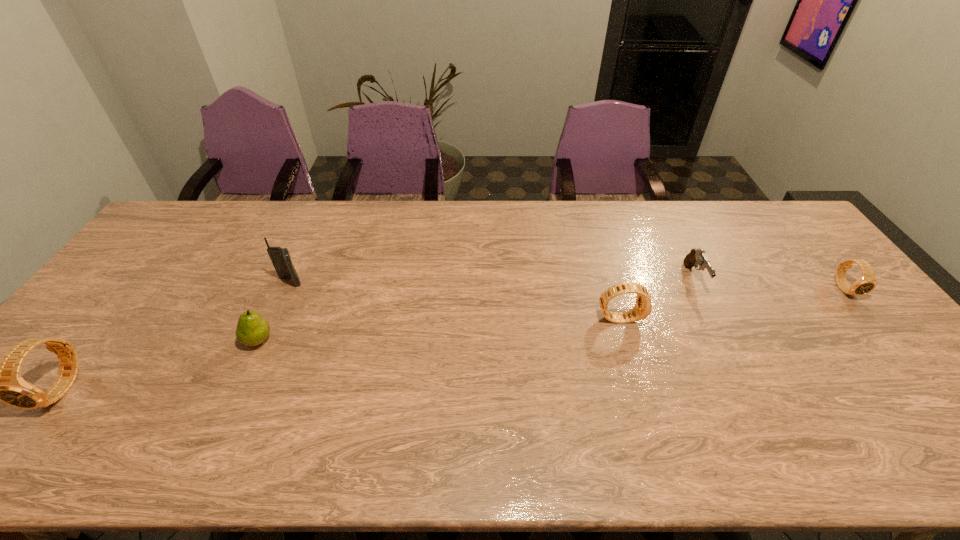
In the image, there is a desktop. Find the location of `vacant space at the left edge`. vacant space at the left edge is located at coordinates (96, 306).

This screenshot has height=540, width=960. In order to click on vacant space at the right edge of the desktop in this screenshot , I will do `click(869, 325)`.

The width and height of the screenshot is (960, 540). In order to click on free space at the far right corner in this screenshot , I will do `click(754, 206)`.

This screenshot has height=540, width=960. Identify the location of free space that is in between the cellular telephone and the second object from right to left. (492, 280).

Find the location of a particular element. free spot between the pistol and the shortest watch is located at coordinates (770, 284).

I want to click on vacant point located between the rightmost object and the second tallest watch, so click(732, 303).

The width and height of the screenshot is (960, 540). I want to click on vacant space in between the second tallest watch and the shortest watch, so click(x=732, y=303).

The image size is (960, 540). Identify the location of free spot between the second watch from right to left and the cellular telephone. (455, 300).

This screenshot has width=960, height=540. What are the coordinates of `vacant point located between the pear and the second watch from left to right` in the screenshot? It's located at (439, 329).

Find the location of a particular element. This screenshot has width=960, height=540. unoccupied position between the pear and the nearest watch is located at coordinates (160, 364).